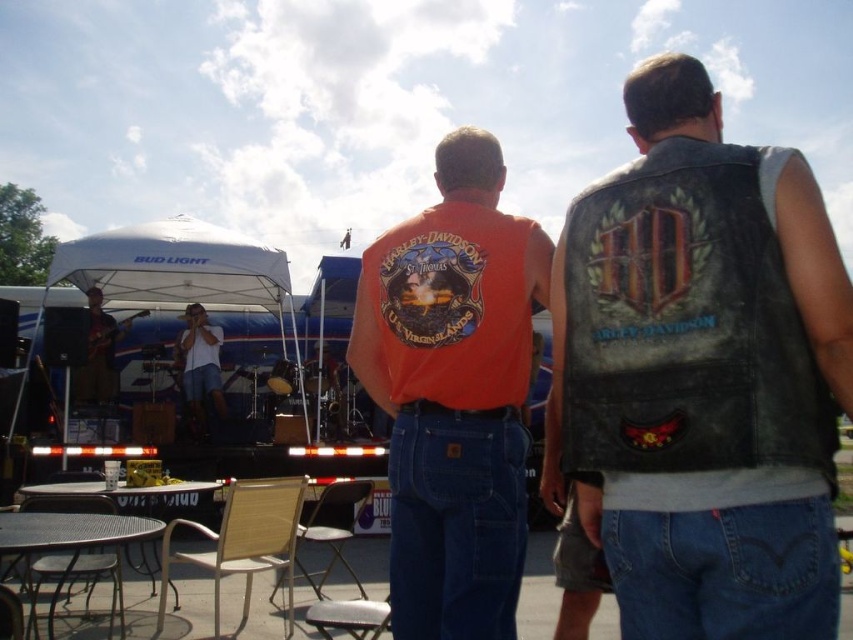
Question: Is leather vest at center further to camera compared to matte black guitar at left?

Choices:
 (A) no
 (B) yes

Answer: (A)

Question: Which point is farther to the camera?

Choices:
 (A) (141, 529)
 (B) (502, 470)
 (C) (70, 268)

Answer: (C)

Question: Among these points, which one is nearest to the camera?

Choices:
 (A) (202, 566)
 (B) (485, 488)

Answer: (B)

Question: Is leather vest at center to the left of metallic mesh table at lower left from the viewer's perspective?

Choices:
 (A) no
 (B) yes

Answer: (A)

Question: Is white fabric canopy at upper left wider than metallic mesh table at lower left?

Choices:
 (A) yes
 (B) no

Answer: (A)

Question: Which of these objects is positioned closest to the orange cotton t-shirt at center?

Choices:
 (A) wooden folding chair at center
 (B) white cotton shirt at center
 (C) light brown woven chair at lower center
 (D) metallic mesh table at lower left

Answer: (D)